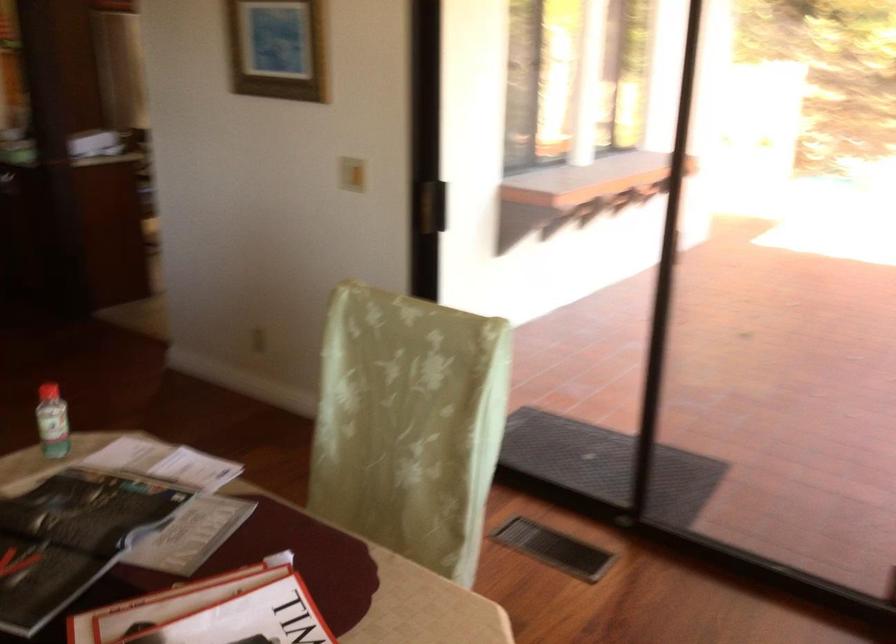
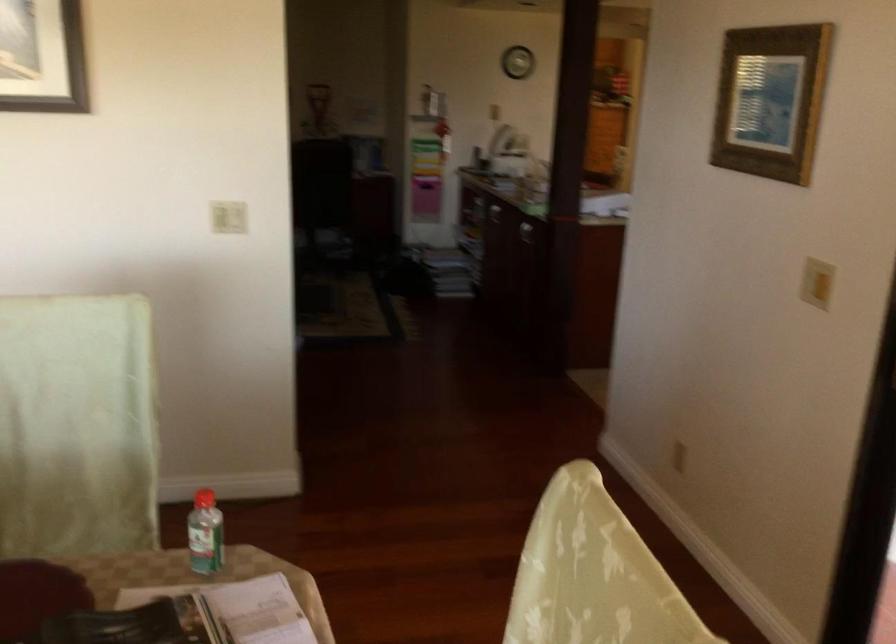
Where in the second image is the point corresponding to point 115,460 from the first image?

(238, 609)